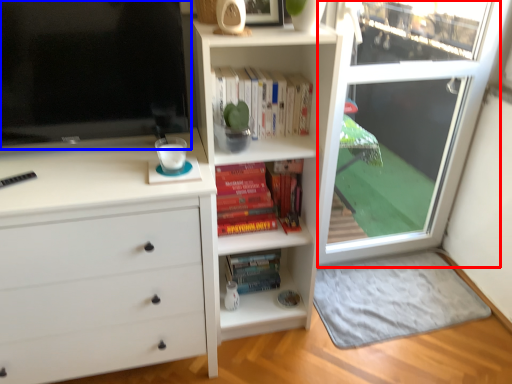
Question: Which object is further to the camera taking this photo, screen door (highlighted by a red box) or television (highlighted by a blue box)?

Choices:
 (A) screen door
 (B) television

Answer: (A)